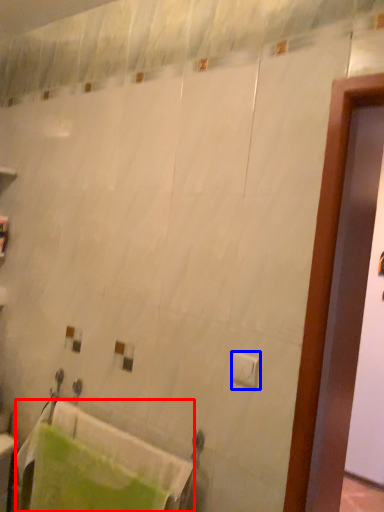
Question: Which of the following is the closest to the observer, bath towel (highlighted by a red box) or toilet paper (highlighted by a blue box)?

Choices:
 (A) bath towel
 (B) toilet paper

Answer: (B)